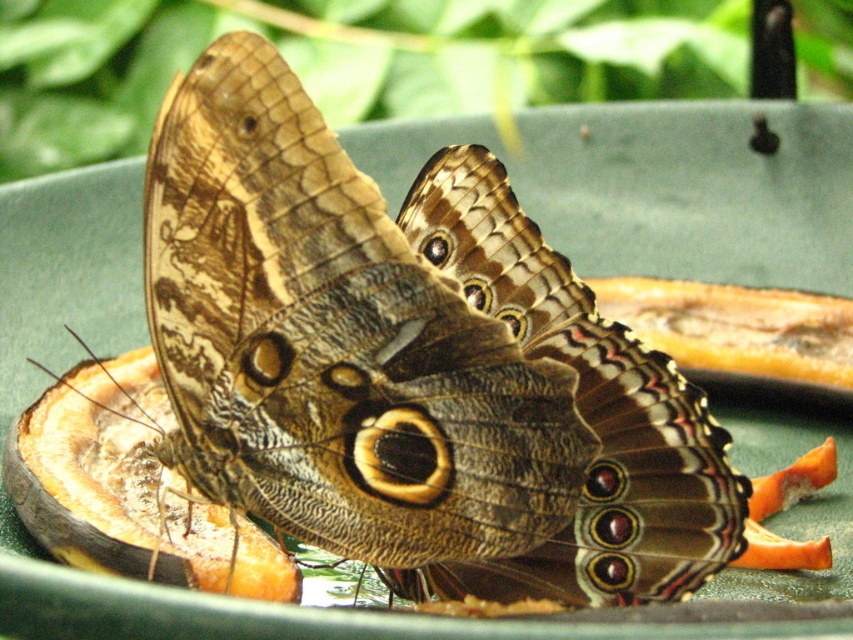
Is point (465, 573) closer to camera compared to point (117, 378)?

That is True.

You are a GUI agent. You are given a task and a screenshot of the screen. Output one action in this format:
    pyautogui.click(x=<x>, y=<y>)
    Task: Click on the brown textured butterfly at center
    
    Given the screenshot: What is the action you would take?
    pyautogui.click(x=579, y=413)

You are a GUI agent. You are given a task and a screenshot of the screen. Output one action in this format:
    pyautogui.click(x=<x>, y=<y>)
    Task: Click on the brown textured butterfly at center
    The height and width of the screenshot is (640, 853).
    Given the screenshot: What is the action you would take?
    pyautogui.click(x=579, y=413)